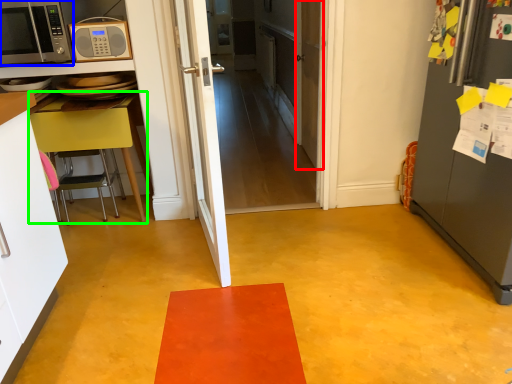
Question: Estimate the real-world distances between objects in this image. Which object is closer to door (highlighted by a red box), microwave oven (highlighted by a blue box) or table (highlighted by a green box)?

Choices:
 (A) microwave oven
 (B) table

Answer: (B)